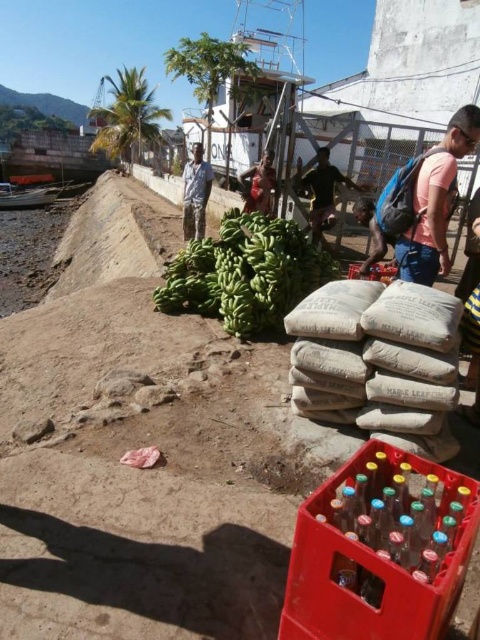
You are a delivery person needing to move a heavy box from the matte blue backpack at center right to the dark brown leather jacket at center. Given that your cart can only navigate paths narrower than 12 feet, will you be able to move the box through the space between them?

The distance between the matte blue backpack at center right and the dark brown leather jacket at center is 11.95 feet, which is less than the 12 feet limit. Therefore, the cart can navigate the path between them to move the box.

You are a delivery person who needs to retrieve your dark brown leather jacket at center. However, there are translucent plastic bottles at lower right blocking your path. Can you easily reach your jacket without moving the bottles?

The translucent plastic bottles at lower right are in front of the dark brown leather jacket at center, so you cannot easily reach the jacket without moving the bottles.